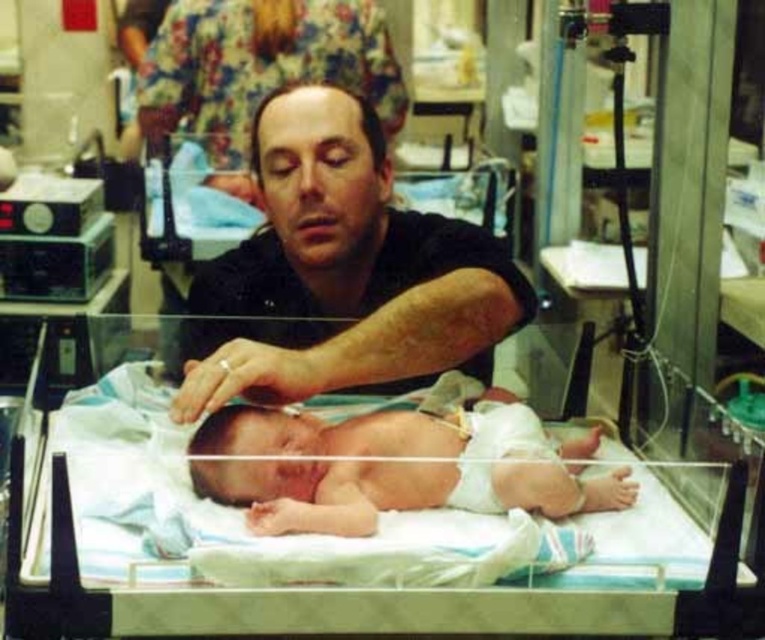
Question: Which point is farther to the camera?

Choices:
 (A) (360, 454)
 (B) (321, 157)
 (C) (382, 557)

Answer: (B)

Question: Can you confirm if white fabric hospital bed at center is thinner than smooth skin newborn at center?

Choices:
 (A) no
 (B) yes

Answer: (A)

Question: Does white fabric hospital bed at center have a lesser width compared to smooth skin man at center?

Choices:
 (A) no
 (B) yes

Answer: (A)

Question: Which object is farther from the camera taking this photo?

Choices:
 (A) smooth skin man at center
 (B) smooth skin newborn at center

Answer: (A)

Question: Which point is closer to the camera?

Choices:
 (A) click(593, 552)
 (B) click(495, 468)

Answer: (A)

Question: Is white fabric hospital bed at center thinner than smooth skin newborn at center?

Choices:
 (A) yes
 (B) no

Answer: (B)